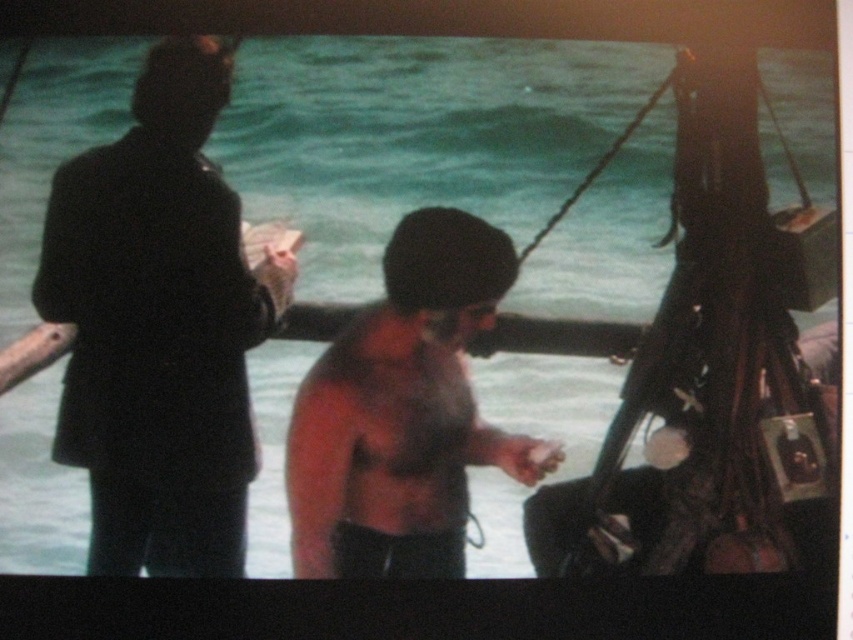
You are a photographer on the ship and want to capture both the black matte suit at left and the shiny skin torso at center in a single frame. Which direction should you move your camera to include both subjects?

You should move your camera to the right to include both the black matte suit at left and the shiny skin torso at center since the black matte suit at left is positioned to the left of the shiny skin torso at center.

Based on the scene description, what are the coordinates of the black matte suit at left?

The coordinates of the black matte suit at left are at point (x=160, y=326).